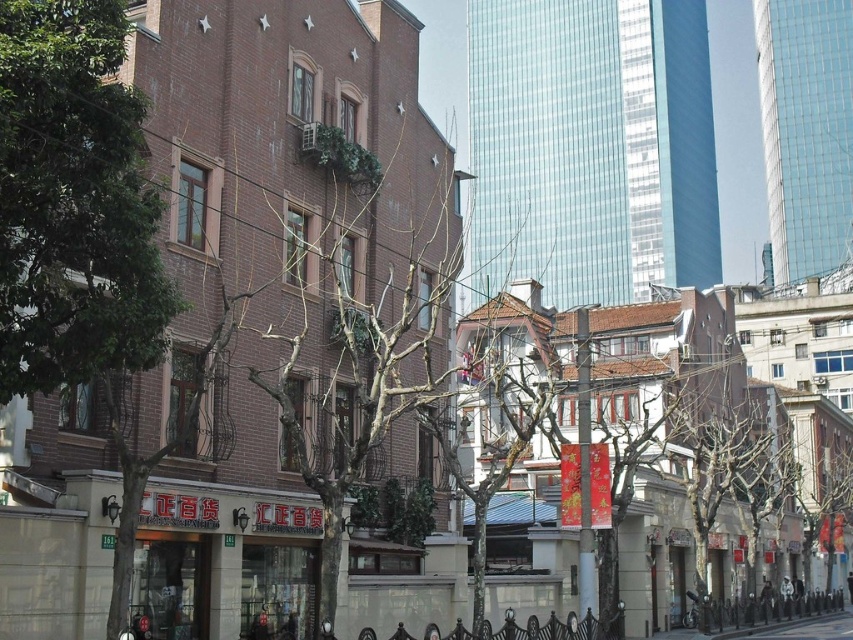
Question: Is green leafy tree at upper left wider than gray concrete pavement at lower center?

Choices:
 (A) no
 (B) yes

Answer: (A)

Question: Which of the following is the farthest from the observer?

Choices:
 (A) gray concrete pavement at lower center
 (B) green leafy tree at upper left

Answer: (A)

Question: Can you confirm if green leafy tree at upper left is positioned to the right of gray concrete pavement at lower center?

Choices:
 (A) yes
 (B) no

Answer: (B)

Question: Is green leafy tree at upper left above gray concrete pavement at lower center?

Choices:
 (A) no
 (B) yes

Answer: (B)